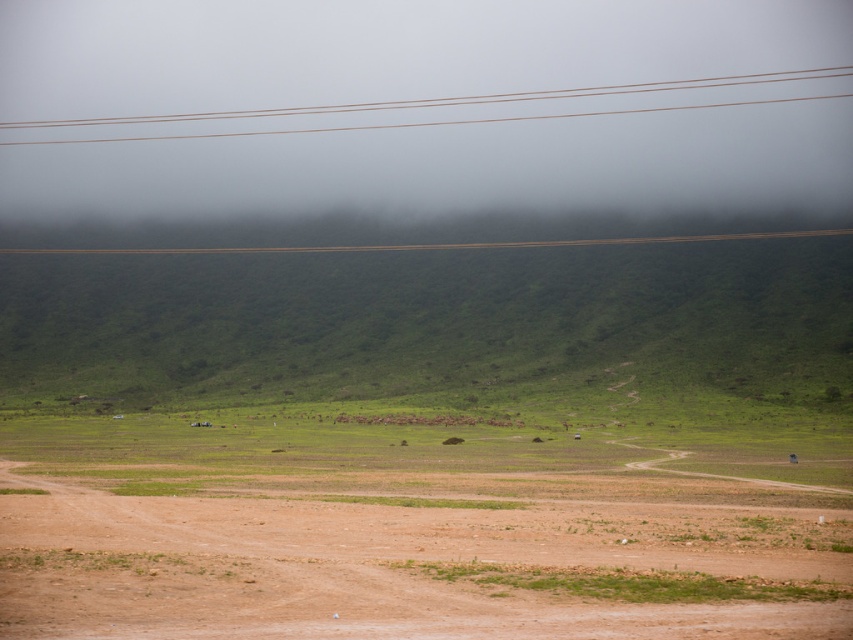
Question: Can you confirm if brown sandy dirt field at lower left is positioned above brown/wooden power lines at upper center?

Choices:
 (A) yes
 (B) no

Answer: (B)

Question: Can you confirm if brown sandy dirt field at lower left is positioned to the left of brown/wooden power lines at upper center?

Choices:
 (A) no
 (B) yes

Answer: (A)

Question: Among these objects, which one is nearest to the camera?

Choices:
 (A) brown/wooden power lines at upper center
 (B) brown sandy dirt field at lower left

Answer: (B)

Question: Can you confirm if brown sandy dirt field at lower left is positioned below brown/wooden power lines at upper center?

Choices:
 (A) yes
 (B) no

Answer: (A)